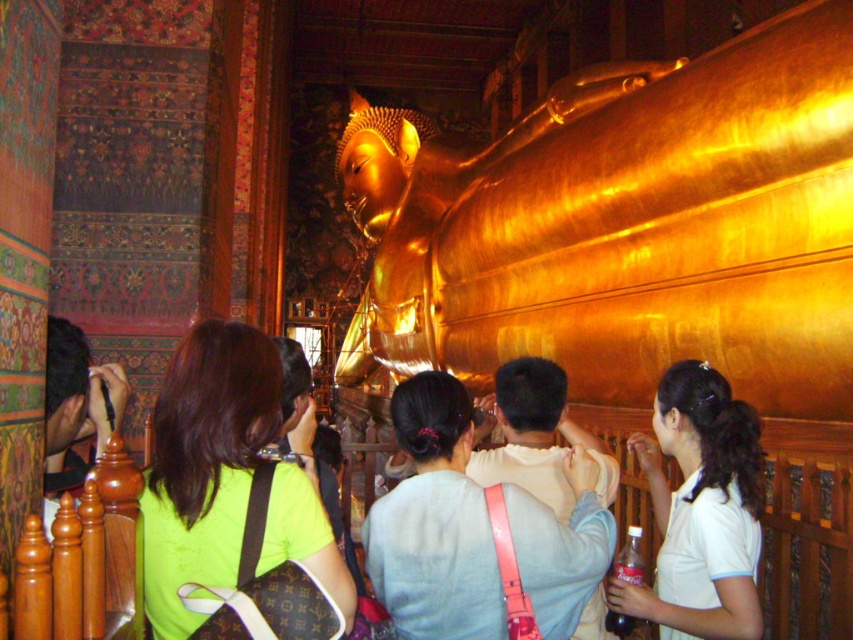
You are a photographer planning to take a closeup shot of the golden reclining Buddha statue on the right. However, you notice a green fabric bag at center and a dark brown hair at left in your current frame. Which object is blocking your view more due to its size?

The green fabric bag at center has a larger size compared to dark brown hair at left, so it is blocking the view more.

In the scene shown: You are a photographer taking a picture of the golden reclining Buddha statue on the right. You notice two people wearing the light blue fabric shirt at center and the white matte shirt at center are blocking your view. Which person should you ask to step aside so you can capture the statue without obstruction?

You should ask the light blue fabric shirt at center to step aside because it is in front of the white matte shirt at center, blocking the view of the golden reclining Buddha statue.

You are a photographer at the temple and need to capture a photo of the golden reclining Buddha statue on the right. You notice two people wearing the light blue fabric shirt at center and the white matte shirt at center are standing in front of the statue. Which shirt is shorter in height between the two?

The light blue fabric shirt at center has a lesser height compared to the white matte shirt at center, so the light blue fabric shirt at center is shorter.